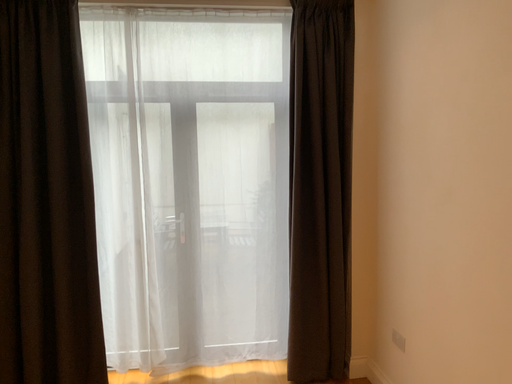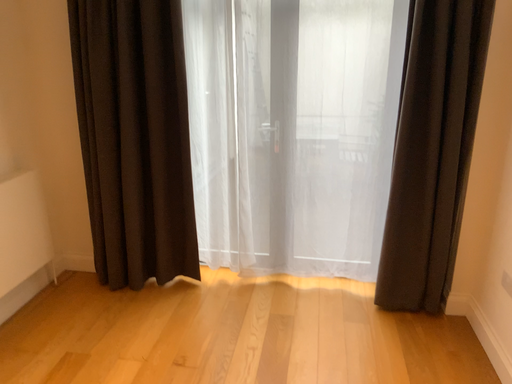
Question: Which way did the camera rotate in the video?

Choices:
 (A) rotated right
 (B) rotated left

Answer: (B)